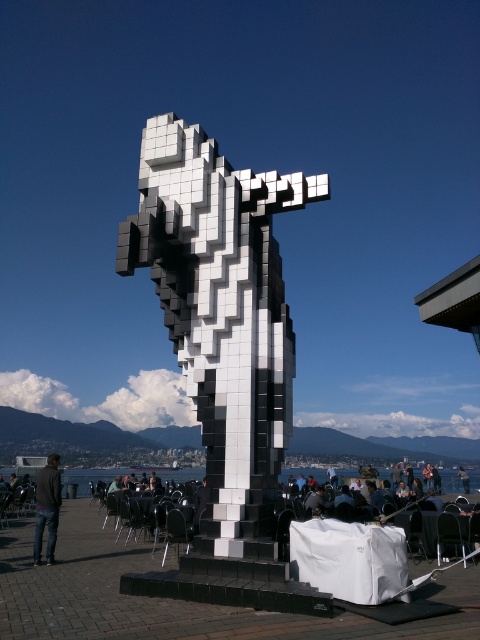
Question: Is black and white pixelated statue at center below transparent glass water at lower center?

Choices:
 (A) no
 (B) yes

Answer: (A)

Question: Where is black and white pixelated statue at center located in relation to dark gray hair at upper right in the image?

Choices:
 (A) below
 (B) above

Answer: (B)

Question: Where is black and white pixelated statue at center located in relation to dark gray hair at upper right in the image?

Choices:
 (A) left
 (B) right

Answer: (A)

Question: Which point is closer to the camera?

Choices:
 (A) (44, 522)
 (B) (254, 506)
 (C) (107, 480)
 (D) (458, 474)

Answer: (B)

Question: Which of the following is the farthest from the observer?

Choices:
 (A) (263, 497)
 (B) (458, 472)

Answer: (B)

Question: Which point is closer to the camera taking this photo?

Choices:
 (A) (468, 481)
 (B) (456, 486)
 (C) (44, 508)

Answer: (C)